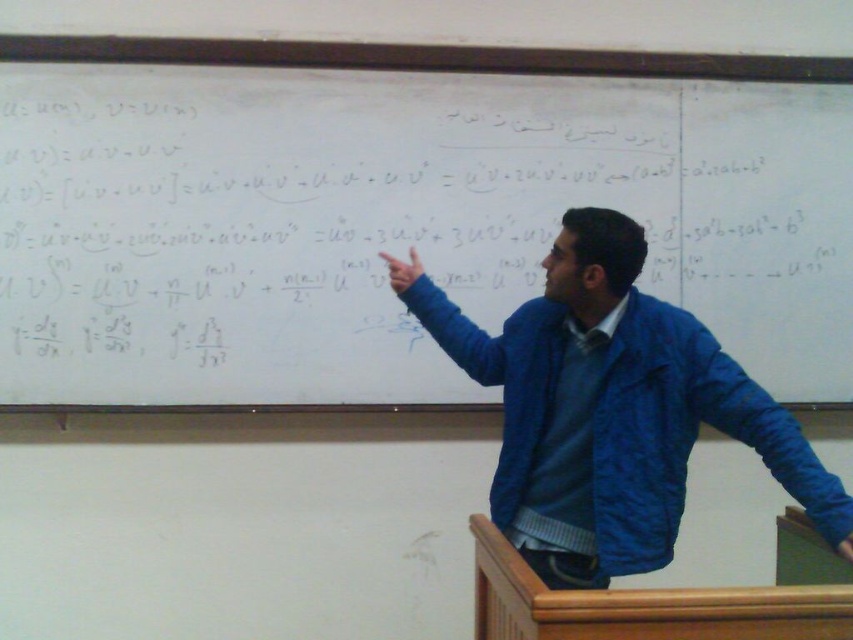
From the picture: You are a student sitting in the front row of the classroom. You need to take a photo of the white matte board at center and the blue fabric jacket at upper center for your notes. Your camera can only focus on objects within a 28 inch range. Will both objects be in focus?

The white matte board at center and blue fabric jacket at upper center are 30.50 inches apart from each other, which exceeds the camera focus range of 28 inches. Therefore, both objects cannot be in focus simultaneously.

You are a student sitting in the classroom and want to take a photo of both the point at (x=805, y=88) and the point at (x=584, y=563) on the whiteboard. Which point will appear closer to the bottom edge of your camera viewfinder?

Point at (x=584, y=563) will appear closer to the bottom edge of the camera viewfinder because it is closer to the camera than point at (x=805, y=88).

You are a student sitting in the classroom and want to write a note on the white matte board at center. Is the board within your reach?

The white matte board at center is located at point (396,221), which is likely out of reach for a student sitting in the classroom. The board is positioned at the front of the room, typically elevated or mounted on a wall, making it inaccessible from a seated position.